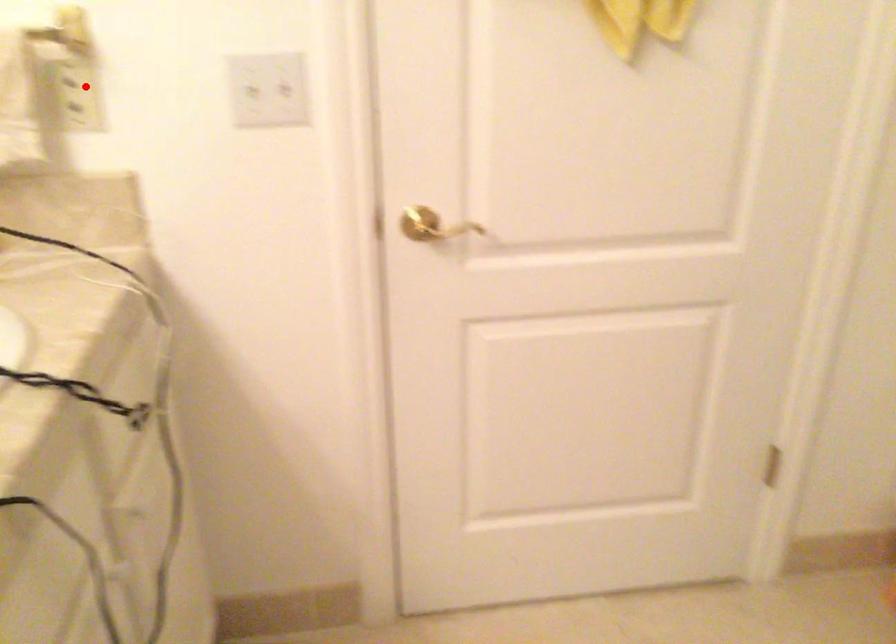
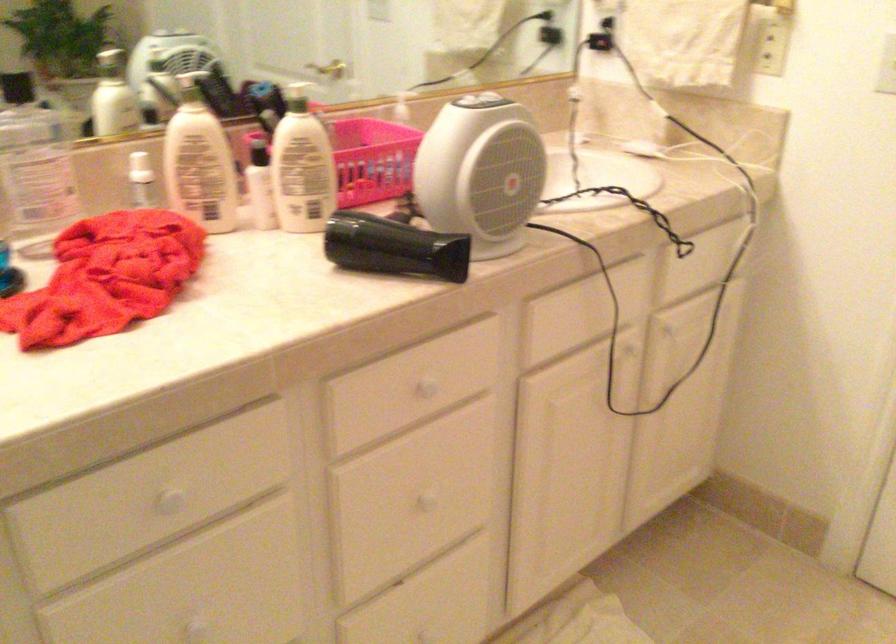
Question: I am providing you with two images of the same scene from different viewpoints. Given a red point in image1, look at the same physical point in image2. Is it:

Choices:
 (A) Closer to the viewpoint
 (B) Farther from the viewpoint

Answer: (B)